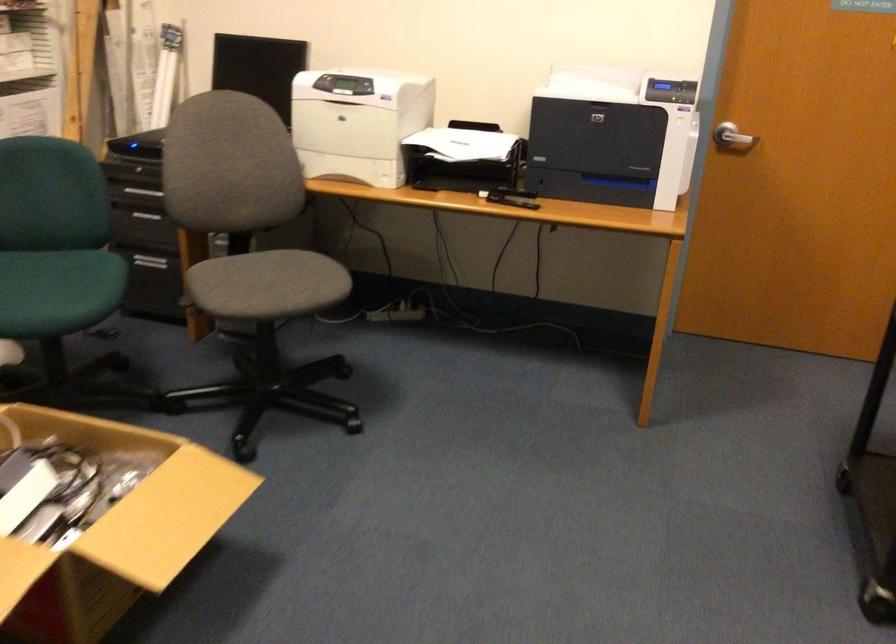
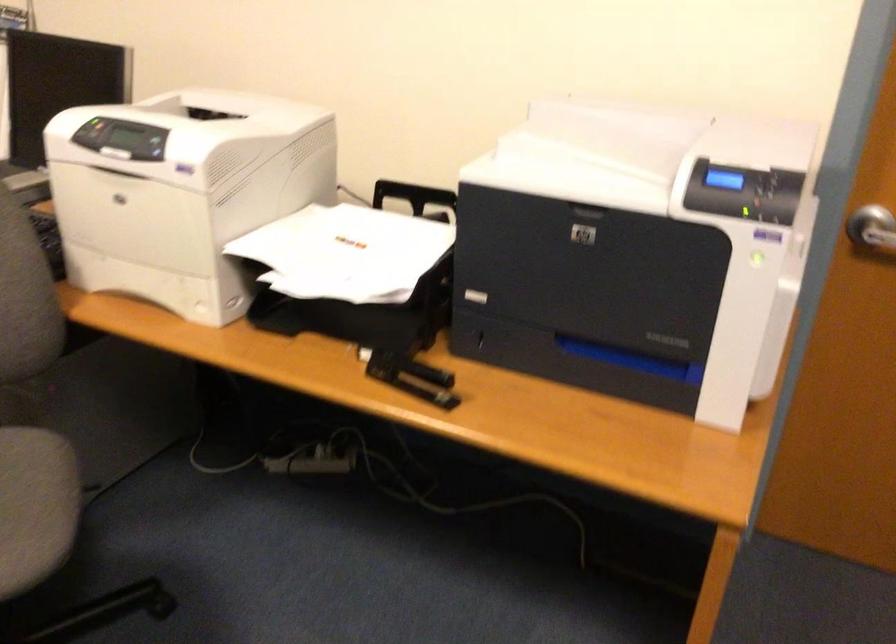
Locate, in the second image, the point that corresponds to the point at 736,131 in the first image.

(872, 230)